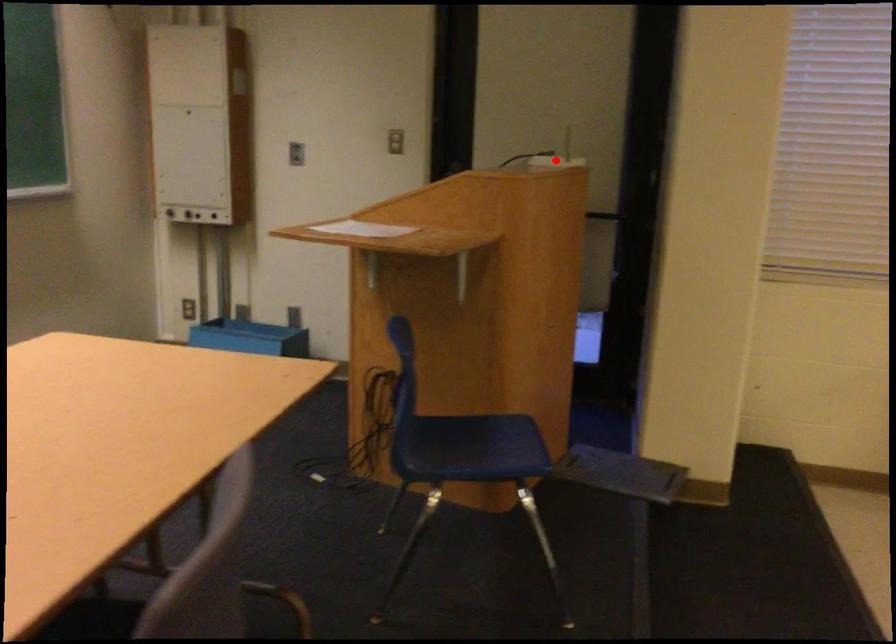
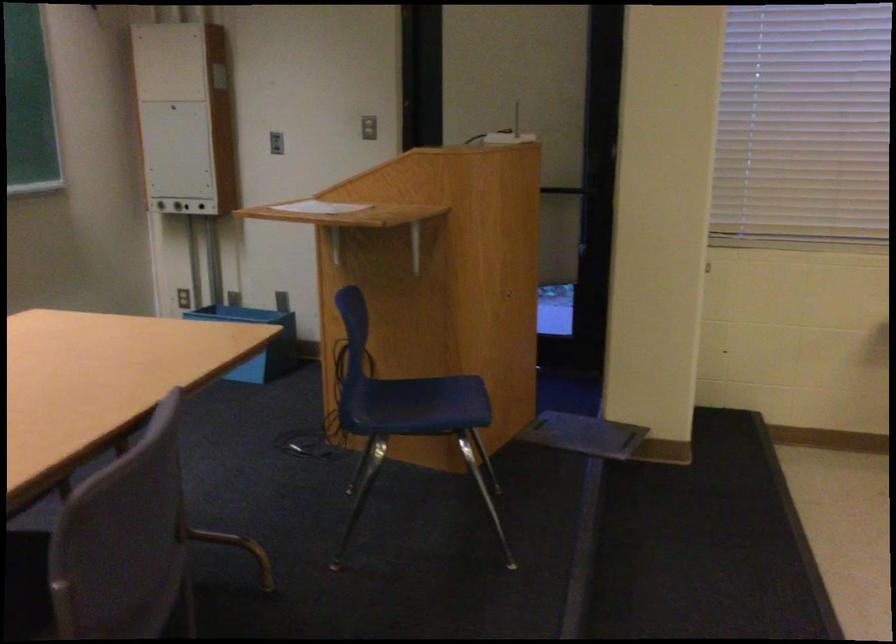
Where in the second image is the point corresponding to the highlighted location from the first image?

(521, 140)